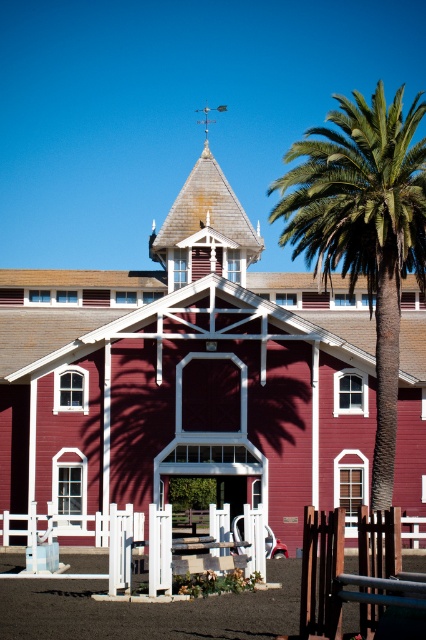
Question: Which point is closer to the camera taking this photo?

Choices:
 (A) click(x=342, y=195)
 (B) click(x=279, y=468)

Answer: (A)

Question: Does matte red barn at center have a lesser width compared to green leafy palm at right?

Choices:
 (A) no
 (B) yes

Answer: (A)

Question: Is matte red barn at center above green leafy palm at right?

Choices:
 (A) yes
 (B) no

Answer: (B)

Question: Is matte red barn at center bigger than green leafy palm at right?

Choices:
 (A) yes
 (B) no

Answer: (B)

Question: Which point is farther to the camera?

Choices:
 (A) (373, 484)
 (B) (331, 355)

Answer: (B)

Question: Which of the following is the farthest from the observer?

Choices:
 (A) (408, 161)
 (B) (103, 506)

Answer: (B)